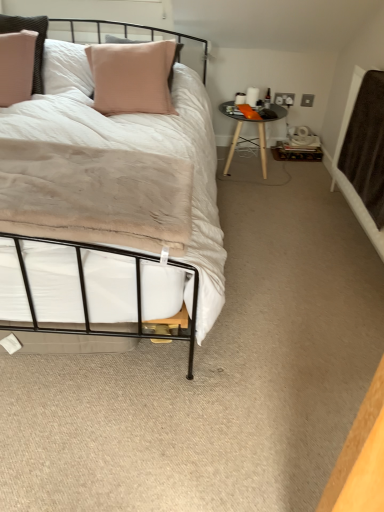
Where is `vacant area in front of black glossy table at center right`? vacant area in front of black glossy table at center right is located at coordinates (258, 196).